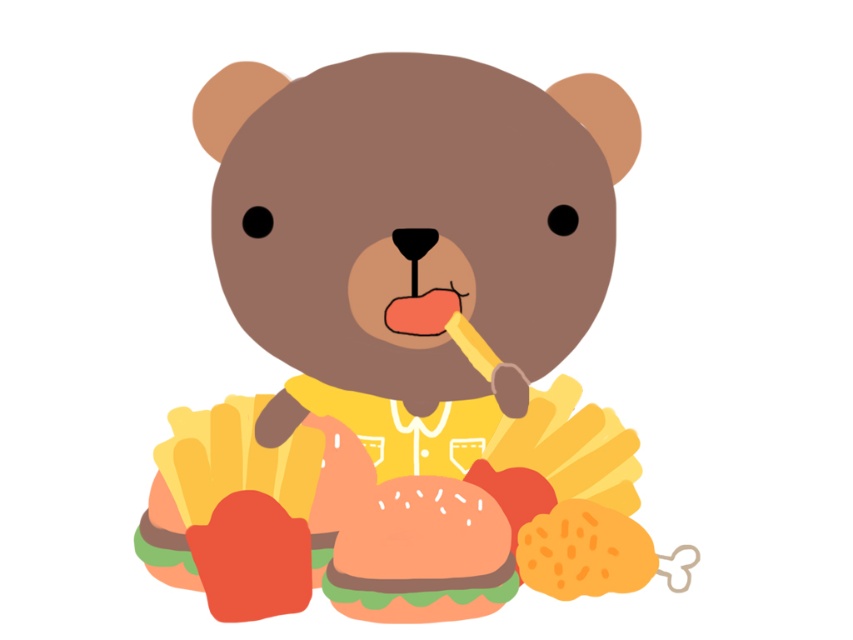
Question: Is matte yellow bear at center below smooth orange hamburger at center?

Choices:
 (A) no
 (B) yes

Answer: (A)

Question: Where is matte yellow bear at center located in relation to smooth orange hamburger at center in the image?

Choices:
 (A) left
 (B) right

Answer: (A)

Question: Which point appears closest to the camera in this image?

Choices:
 (A) (389, 573)
 (B) (374, 435)

Answer: (A)

Question: Does matte yellow bear at center have a lesser width compared to smooth orange hamburger at center?

Choices:
 (A) no
 (B) yes

Answer: (A)

Question: Which object appears closest to the camera in this image?

Choices:
 (A) matte yellow bear at center
 (B) smooth orange hamburger at center

Answer: (A)

Question: Which of the following is the closest to the observer?

Choices:
 (A) (340, 212)
 (B) (492, 572)

Answer: (A)